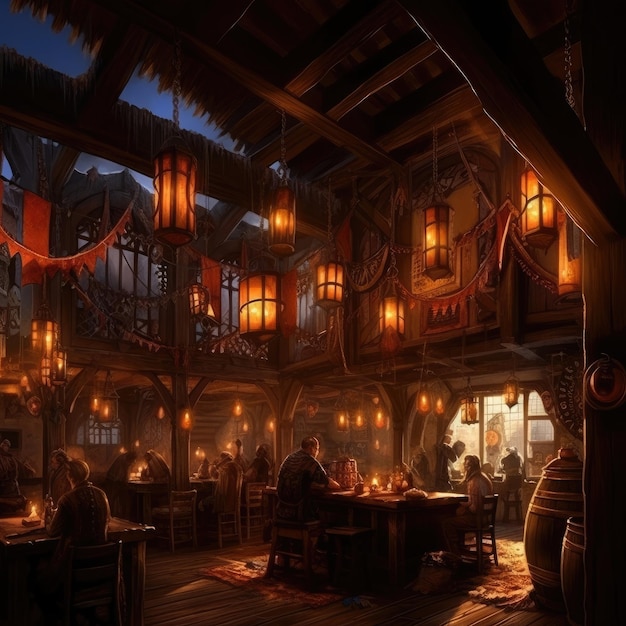
Identify the location of chair. Image resolution: width=626 pixels, height=626 pixels. (109, 555).